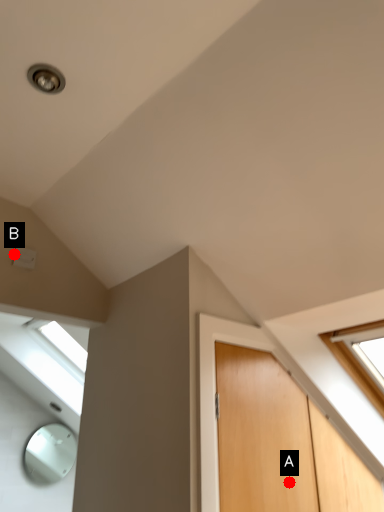
Question: Two points are circled on the image, labeled by A and B beside each circle. Among these points, which one is nearest to the camera?

Choices:
 (A) A is closer
 (B) B is closer

Answer: (A)